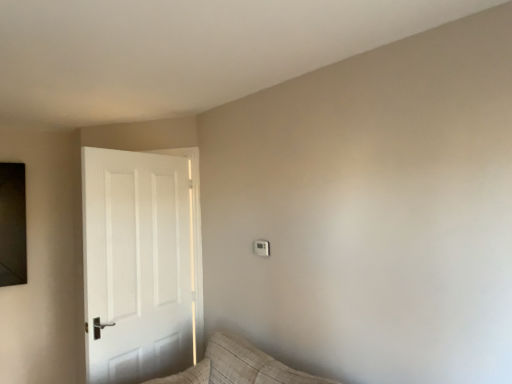
Question: Would you say white matte door at left is a long distance from white plastic light switch at upper center?

Choices:
 (A) no
 (B) yes

Answer: (A)

Question: From the image's perspective, is white matte door at left over white plastic light switch at upper center?

Choices:
 (A) yes
 (B) no

Answer: (B)

Question: Can white plastic light switch at upper center be found inside white matte door at left?

Choices:
 (A) yes
 (B) no

Answer: (B)

Question: Is white plastic light switch at upper center at the back of white matte door at left?

Choices:
 (A) no
 (B) yes

Answer: (B)

Question: From a real-world perspective, does white matte door at left stand above white plastic light switch at upper center?

Choices:
 (A) no
 (B) yes

Answer: (A)

Question: Is white matte door at left positioned beyond the bounds of white plastic light switch at upper center?

Choices:
 (A) yes
 (B) no

Answer: (A)

Question: Is white plastic light switch at upper center taller than white matte door at left?

Choices:
 (A) no
 (B) yes

Answer: (A)

Question: Can you confirm if white plastic light switch at upper center is wider than white matte door at left?

Choices:
 (A) no
 (B) yes

Answer: (A)

Question: Does white plastic light switch at upper center lie in front of white matte door at left?

Choices:
 (A) no
 (B) yes

Answer: (A)

Question: Are white plastic light switch at upper center and white matte door at left located far from each other?

Choices:
 (A) no
 (B) yes

Answer: (A)

Question: Does white plastic light switch at upper center contain white matte door at left?

Choices:
 (A) yes
 (B) no

Answer: (B)

Question: Is white plastic light switch at upper center positioned beyond the bounds of white matte door at left?

Choices:
 (A) yes
 (B) no

Answer: (A)

Question: Does point (179, 162) appear closer or farther from the camera than point (252, 249)?

Choices:
 (A) closer
 (B) farther

Answer: (B)